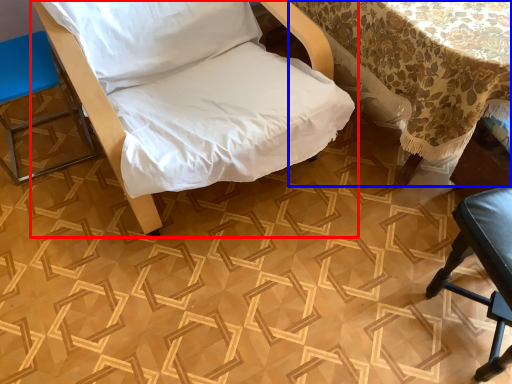
Question: Which point is further to the camera, furniture (highlighted by a red box) or table (highlighted by a blue box)?

Choices:
 (A) furniture
 (B) table

Answer: (B)